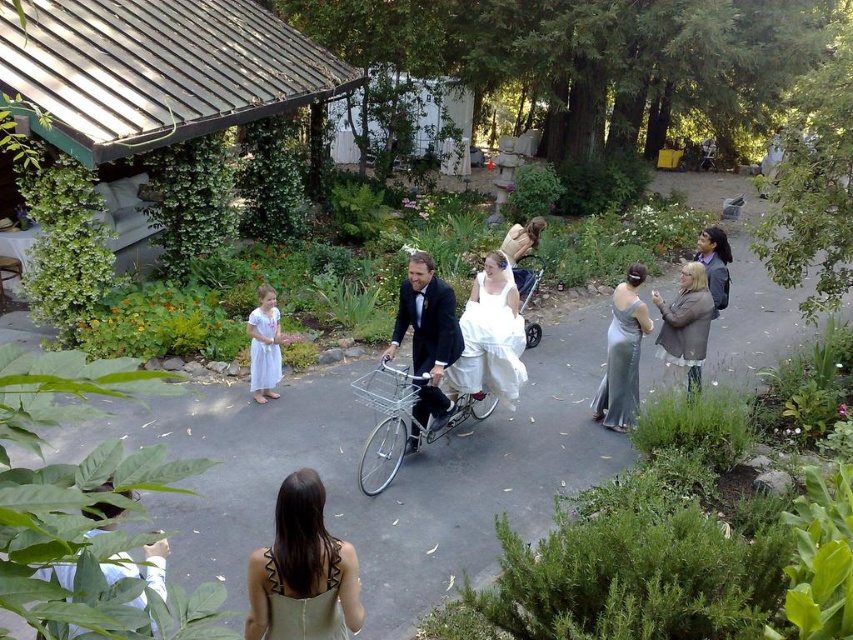
You are a photographer at the wedding reception. You need to capture a photo that includes both the shiny black suit at center and the matte black bicycle at center. Since the bicycle is wider, you decide to position the camera closer to the narrower object. Which object should you move closer to?

The shiny black suit at center is narrower than the matte black bicycle at center. To include both in the photo, you should position the camera closer to the shiny black suit at center.

You are a photographer at the wedding reception. You want to take a photo of the silver metallic bicycle at center and the white satin dress at left. Based on their positions, which object is closer to the right side of the photo?

The silver metallic bicycle at center is positioned on the right side of white satin dress at left, so the silver metallic bicycle at center is closer to the right side of the photo.

You are a photographer at the wedding reception, and you need to capture a photo of the shiny black suit at center and the matte black bicycle at center. Which object is positioned higher in the image?

The shiny black suit at center is located above the matte black bicycle at center, so it is positioned higher in the image.